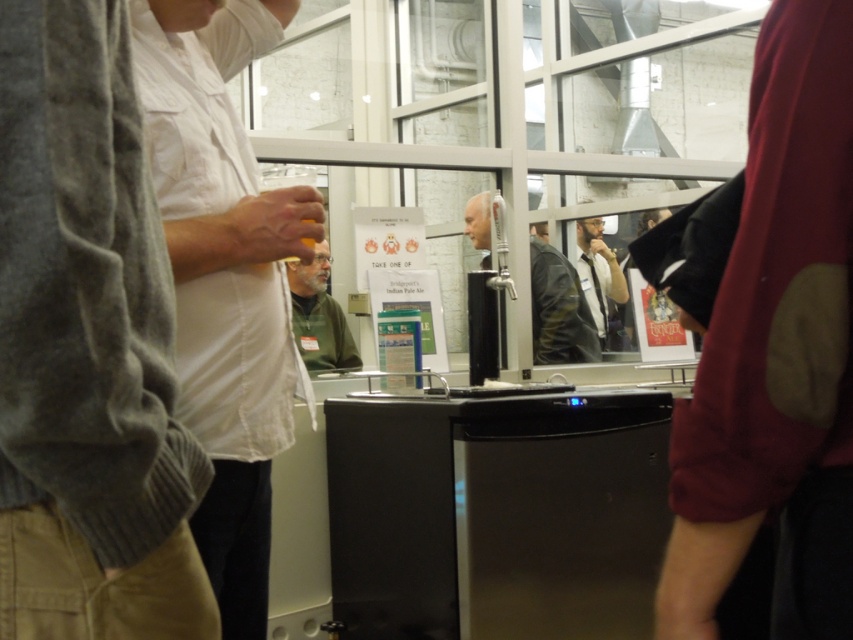
Question: Does knitted gray sweater at left appear on the left side of white matte shirt at center?

Choices:
 (A) yes
 (B) no

Answer: (A)

Question: Which object is farther from the camera taking this photo?

Choices:
 (A) black leather jacket at center
 (B) leather jacket at center
 (C) white matte shirt at center
 (D) translucent glass beverage at center

Answer: (A)

Question: Which is farther from the translucent glass beverage at center?

Choices:
 (A) leather jacket at center
 (B) white matte shirt at center

Answer: (A)

Question: Among these points, which one is nearest to the camera?

Choices:
 (A) (93, 93)
 (B) (285, 257)
 (C) (602, 332)

Answer: (A)

Question: Is knitted gray sweater at left smaller than translucent glass beverage at center?

Choices:
 (A) no
 (B) yes

Answer: (A)

Question: Does knitted gray sweater at left have a lesser width compared to leather jacket at center?

Choices:
 (A) yes
 (B) no

Answer: (A)